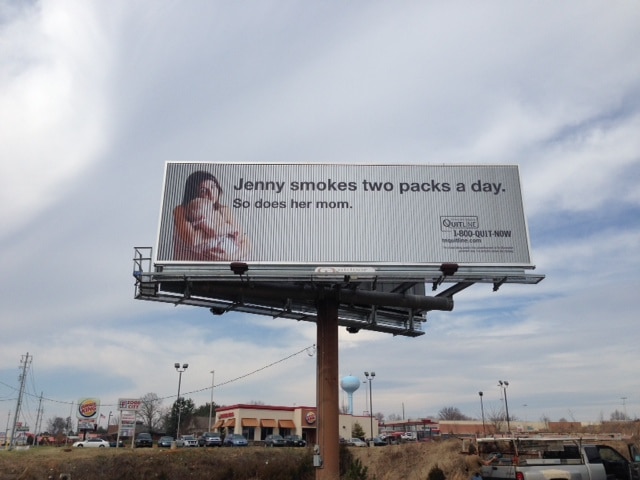
You are a GUI agent. You are given a task and a screenshot of the screen. Output one action in this format:
    pyautogui.click(x=<x>, y=<y>)
    Task: Click on the electric wires
    The width and height of the screenshot is (640, 480).
    Given the screenshot: What is the action you would take?
    pyautogui.click(x=4, y=384), pyautogui.click(x=32, y=393), pyautogui.click(x=58, y=397), pyautogui.click(x=104, y=404), pyautogui.click(x=166, y=393), pyautogui.click(x=195, y=390), pyautogui.click(x=290, y=354), pyautogui.click(x=6, y=396), pyautogui.click(x=29, y=408), pyautogui.click(x=29, y=377)